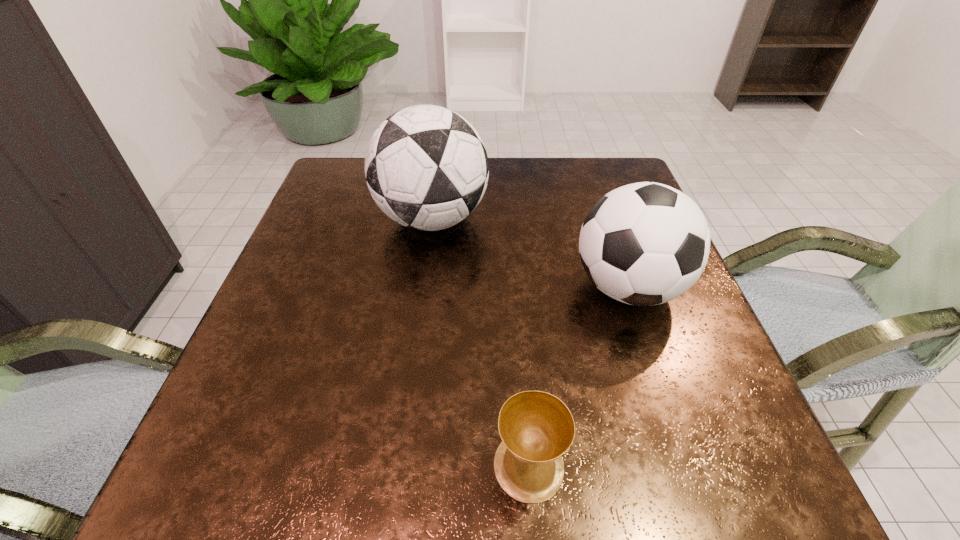
Image resolution: width=960 pixels, height=540 pixels. In order to click on vacant space that satisfies the following two spatial constraints: 1. on the surface of the left soccer ball where the brand logo is visible; 2. on the back side of the chalice in this screenshot , I will do `click(400, 465)`.

Identify the location of vacant region that satisfies the following two spatial constraints: 1. on the surface of the second tallest object where the brand logo is visible; 2. on the right side of the taller soccer ball. (423, 287).

Locate an element on the screen. The image size is (960, 540). vacant area in the image that satisfies the following two spatial constraints: 1. on the surface of the chalice where the brand logo is visible; 2. on the right side of the taller soccer ball is located at coordinates (400, 465).

At what (x,y) coordinates should I click in order to perform the action: click on free spot that satisfies the following two spatial constraints: 1. on the surface of the second tallest object where the brand logo is visible; 2. on the right side of the taller soccer ball. Please return your answer as a coordinate pair (x, y). Image resolution: width=960 pixels, height=540 pixels. Looking at the image, I should click on (423, 287).

Locate an element on the screen. free space that satisfies the following two spatial constraints: 1. on the back side of the second shortest object; 2. on the surface of the left soccer ball where the brand logo is visible is located at coordinates (605, 219).

You are a GUI agent. You are given a task and a screenshot of the screen. Output one action in this format:
    pyautogui.click(x=<x>, y=<y>)
    Task: Click on the free space that satisfies the following two spatial constraints: 1. on the back side of the chalice; 2. on the right side of the rightmost object
    The width and height of the screenshot is (960, 540).
    Given the screenshot: What is the action you would take?
    pyautogui.click(x=515, y=287)

The image size is (960, 540). What are the coordinates of `vacant area that satisfies the following two spatial constraints: 1. on the back side of the shortest object; 2. on the right side of the shorter soccer ball` in the screenshot? It's located at (515, 287).

Find the location of `free space that satisfies the following two spatial constraints: 1. on the surface of the tallest object where the brand logo is visible; 2. on the back side of the chalice`. free space that satisfies the following two spatial constraints: 1. on the surface of the tallest object where the brand logo is visible; 2. on the back side of the chalice is located at coordinates (400, 465).

Locate an element on the screen. The image size is (960, 540). free spot that satisfies the following two spatial constraints: 1. on the surface of the rightmost object where the brand logo is visible; 2. on the left side of the tallest object is located at coordinates (423, 287).

The height and width of the screenshot is (540, 960). I want to click on blank space that satisfies the following two spatial constraints: 1. on the surface of the shorter soccer ball where the brand logo is visible; 2. on the right side of the leftmost object, so click(x=423, y=287).